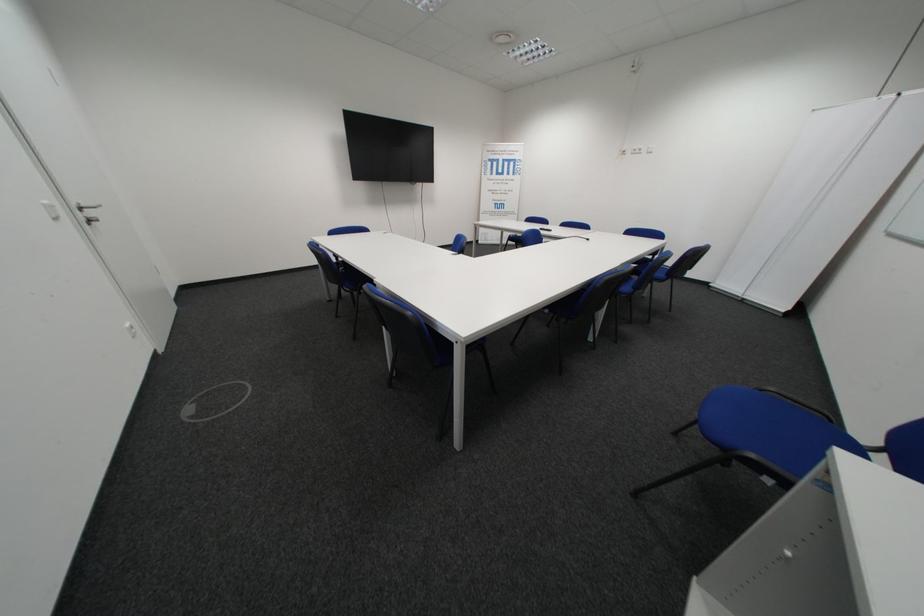
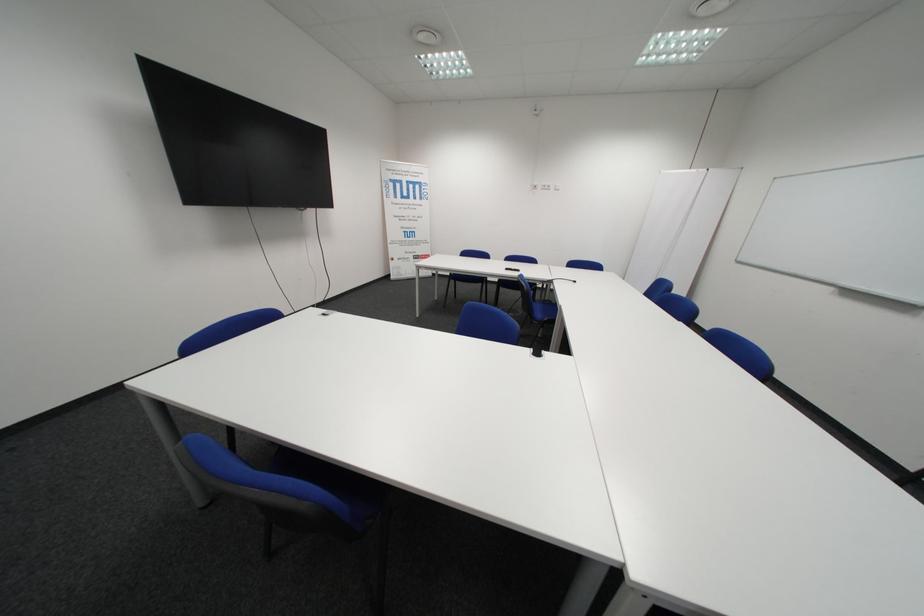
Where in the second image is the point corresponding to pixel 646 153 from the first image?

(554, 188)